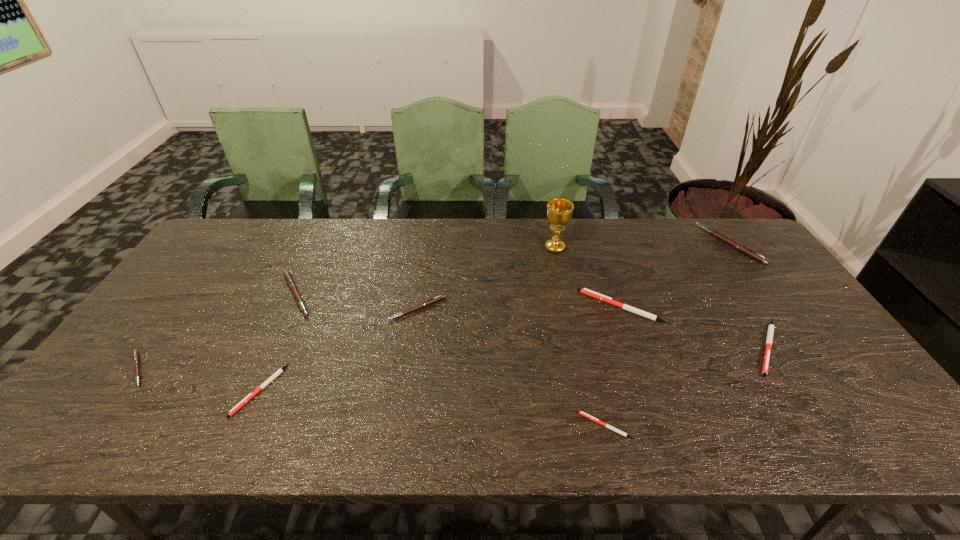
This screenshot has width=960, height=540. I want to click on the nearest pink pen, so click(x=135, y=352).

The image size is (960, 540). Identify the location of the leftmost white pen. (269, 380).

This screenshot has width=960, height=540. I want to click on the shortest pen, so click(594, 419).

The height and width of the screenshot is (540, 960). In order to click on the smallest white pen in this screenshot , I will do `click(594, 419)`.

I want to click on vacant space located 0.070m on the back of the chalice, so click(x=551, y=228).

At what (x,y) coordinates should I click in order to perform the action: click on free region located at the nib of the tallest pen. Please return your answer as a coordinate pair (x, y). Looking at the image, I should click on (689, 245).

Image resolution: width=960 pixels, height=540 pixels. I want to click on free spot located 0.060m at the nib of the tallest pen, so click(689, 245).

Locate an element on the screen. Image resolution: width=960 pixels, height=540 pixels. vacant space located at the nib of the tallest pen is located at coordinates (x=618, y=245).

Locate an element on the screen. This screenshot has height=540, width=960. free space located at the nib of the third smallest pink pen is located at coordinates (426, 295).

Locate an element on the screen. This screenshot has height=540, width=960. vacant point located on the clicker of the biggest white pen is located at coordinates (532, 307).